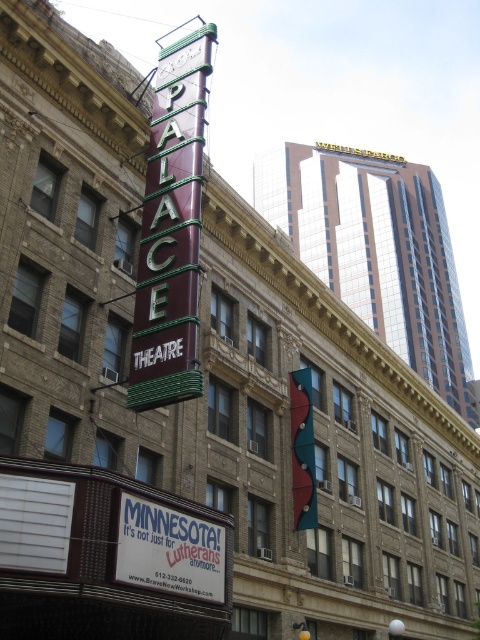
The height and width of the screenshot is (640, 480). Find the location of `maroon enamel sign at center-left`. maroon enamel sign at center-left is located at coordinates (170, 230).

Can you confirm if maroon enamel sign at center-left is taller than white plastic sign at center?

Yes.

Which is in front, point (175, 234) or point (160, 557)?

Point (160, 557) is in front.

Identify the location of maroon enamel sign at center-left. The width and height of the screenshot is (480, 640). (170, 230).